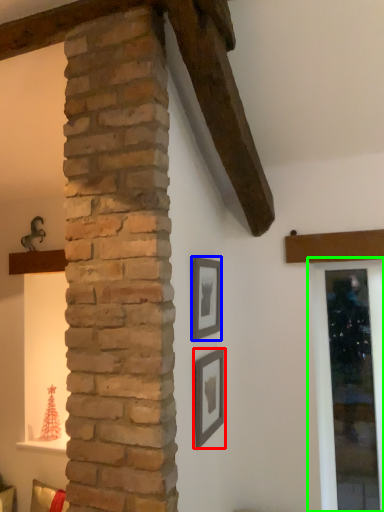
Question: Estimate the real-world distances between objects in this image. Which object is farther from picture frame (highlighted by a red box), picture frame (highlighted by a blue box) or window frame (highlighted by a green box)?

Choices:
 (A) picture frame
 (B) window frame

Answer: (B)